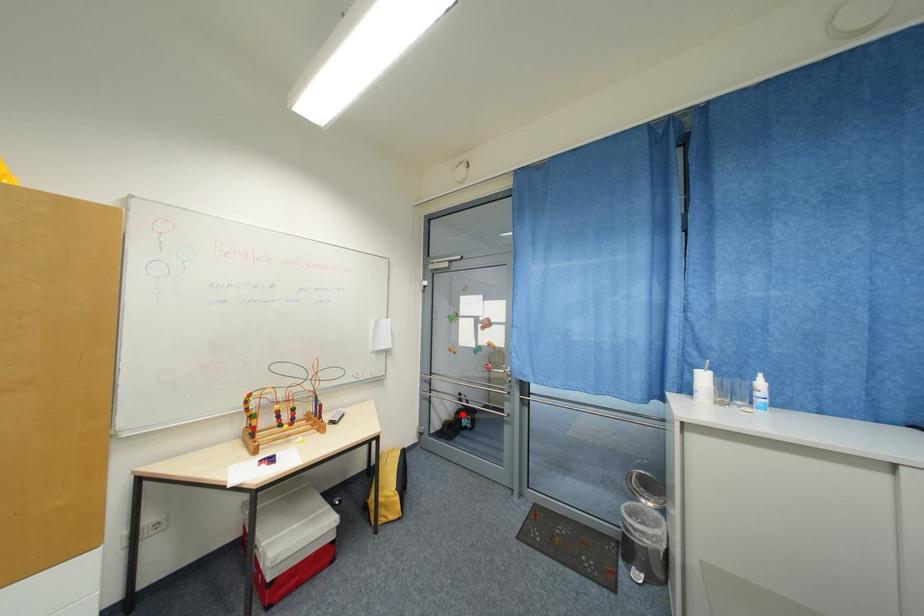
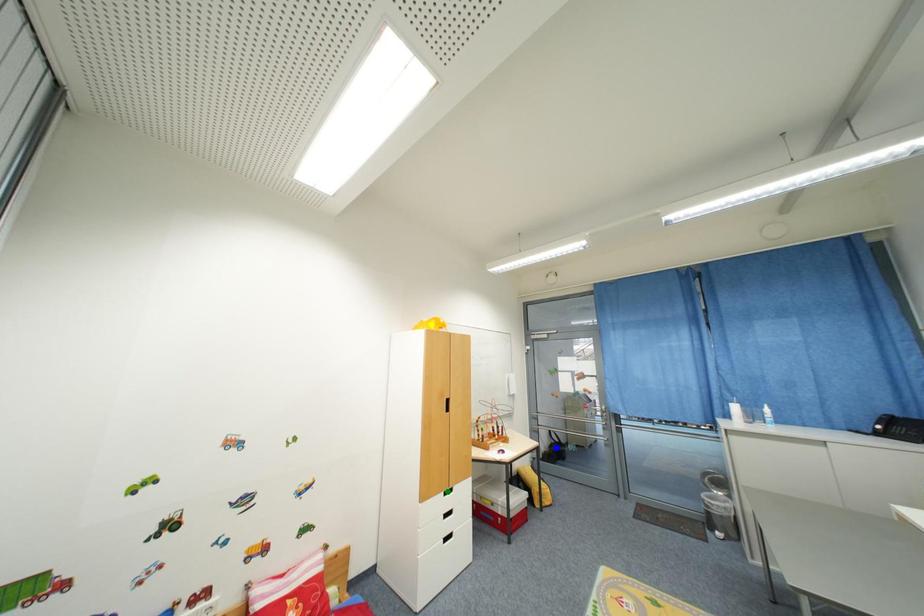
Question: I am providing you with two images of the same scene from different viewpoints. A red point is marked on the first image. You are given multiple points on the second image. Can you choose the point in image 2 that corresponds to the point in image 1?

Choices:
 (A) blue point
 (B) green point
 (C) yellow point

Answer: (A)